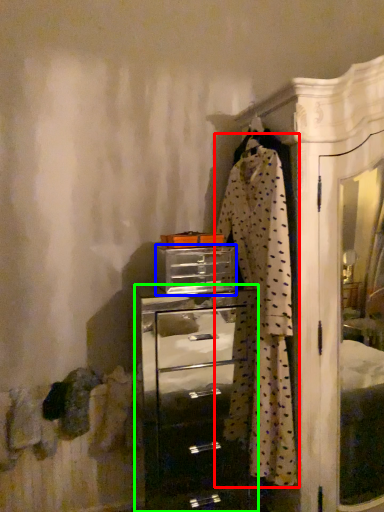
Question: Based on their relative distances, which object is farther from clothing (highlighted by a red box)? Choose from drawer (highlighted by a blue box) and chest of drawers (highlighted by a green box).

Choices:
 (A) drawer
 (B) chest of drawers

Answer: (B)